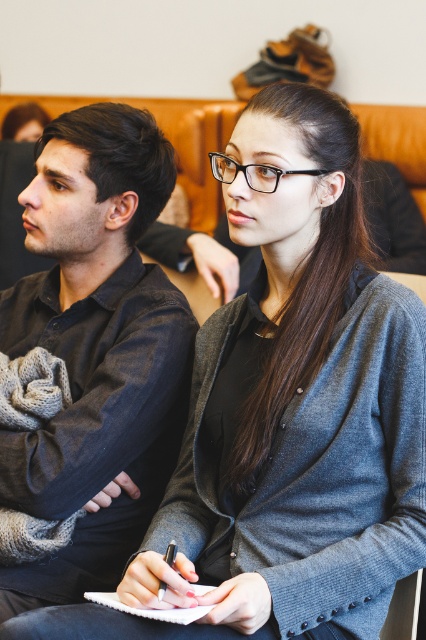
Question: Observing the image, what is the correct spatial positioning of white paper notebook at center in reference to metallic pen at center?

Choices:
 (A) below
 (B) above

Answer: (A)

Question: Which point is closer to the camera?

Choices:
 (A) white paper notebook at center
 (B) metallic pen at center
 (C) denim shirt at left

Answer: (A)

Question: Among these objects, which one is farthest from the camera?

Choices:
 (A) white paper notebook at center
 (B) denim shirt at left
 (C) metallic pen at center

Answer: (B)

Question: Can you confirm if white paper notebook at center is smaller than metallic pen at center?

Choices:
 (A) no
 (B) yes

Answer: (A)

Question: Is denim shirt at left wider than white paper notebook at center?

Choices:
 (A) no
 (B) yes

Answer: (B)

Question: Which point appears closest to the camera in this image?

Choices:
 (A) (149, 188)
 (B) (170, 561)

Answer: (B)